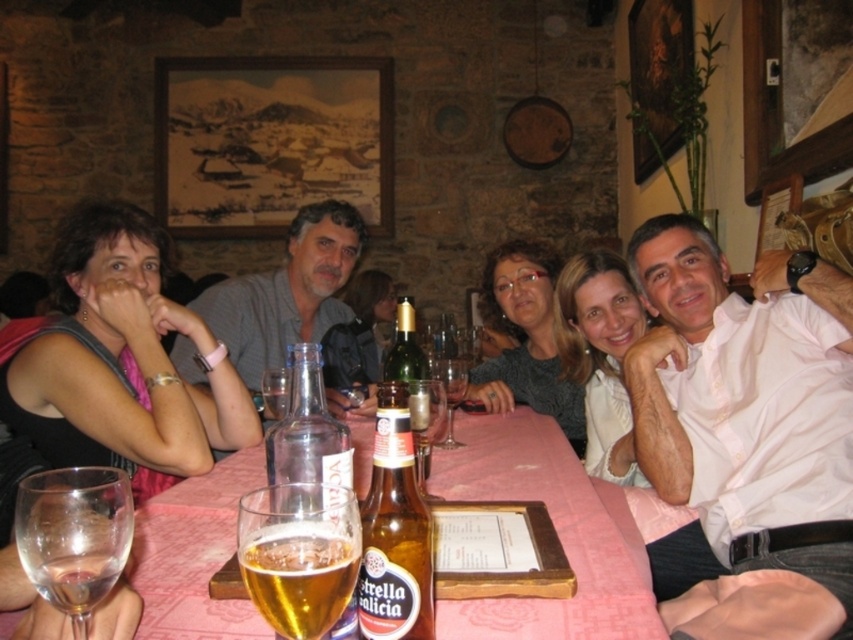
Between gray matte shirt at center and clear glass beer at center, which one has less height?

clear glass beer at center

Does gray matte shirt at center have a larger size compared to clear glass beer at center?

Correct, gray matte shirt at center is larger in size than clear glass beer at center.

In the scene shown: Who is more distant from viewer, (254, 344) or (247, 508)?

The point (254, 344) is more distant.

Where is `gray matte shirt at center`? This screenshot has width=853, height=640. gray matte shirt at center is located at coordinates (287, 291).

Between white shirt at right and pink fabric table at center, which one has less height?

Standing shorter between the two is pink fabric table at center.

Can you confirm if white shirt at right is positioned below pink fabric table at center?

No.

What do you see at coordinates (744, 426) in the screenshot? I see `white shirt at right` at bounding box center [744, 426].

What are the coordinates of `white shirt at right` in the screenshot? It's located at (744, 426).

Does green glass bottle at center appear on the left side of transparent glass wine glass at center?

Indeed, green glass bottle at center is positioned on the left side of transparent glass wine glass at center.

Measure the distance from green glass bottle at center to transparent glass wine glass at center.

A distance of 4.35 inches exists between green glass bottle at center and transparent glass wine glass at center.

Where is `green glass bottle at center`? This screenshot has width=853, height=640. green glass bottle at center is located at coordinates (404, 348).